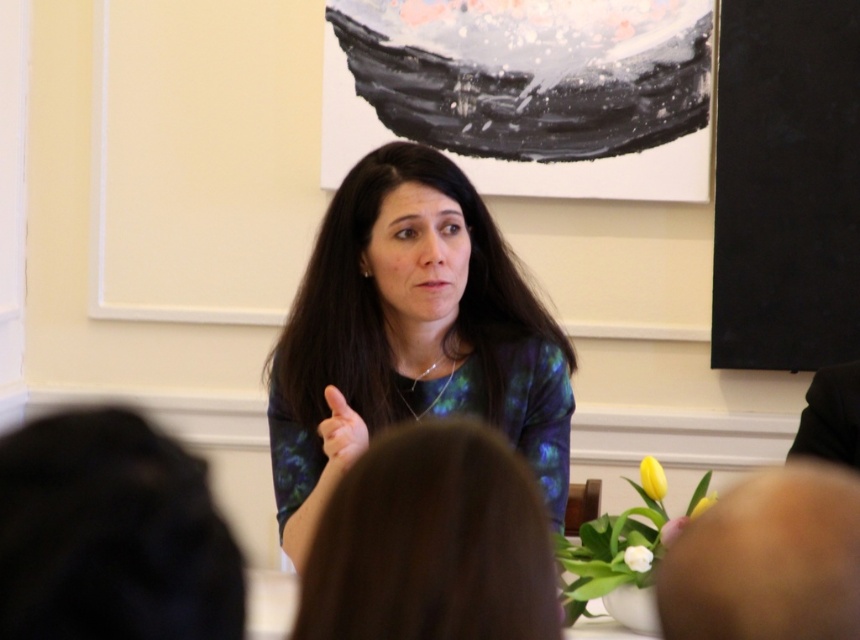
I want to click on blue printed shirt at center, so click(x=409, y=336).